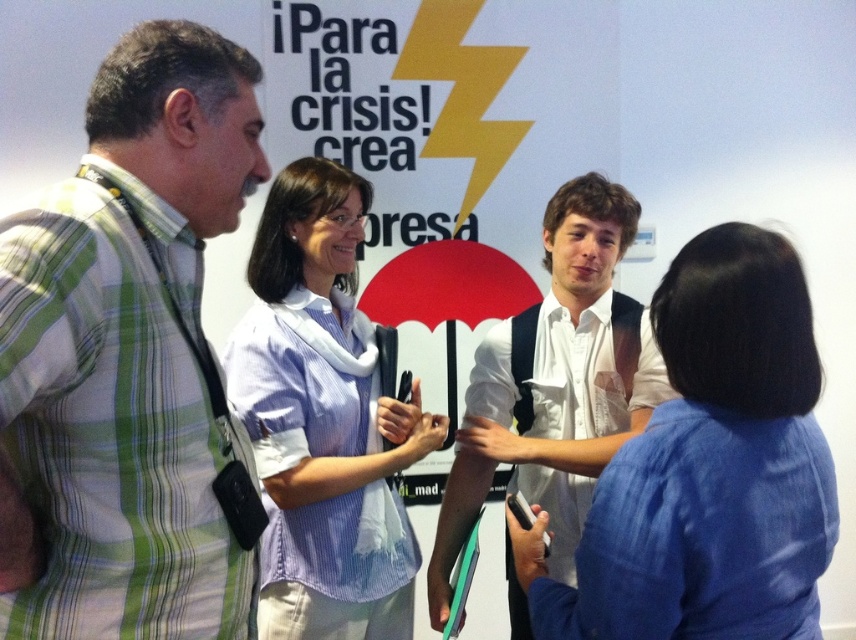
Can you confirm if blue cotton shirt at center is bigger than white shirt at center?

Actually, blue cotton shirt at center might be smaller than white shirt at center.

Which is in front, point (516, 570) or point (657, 365)?

Point (516, 570) is in front.

Between point (783, 337) and point (530, 449), which one is positioned behind?

The point (530, 449) is more distant.

Find the location of a particular element. The image size is (856, 640). blue cotton shirt at center is located at coordinates (709, 468).

Which is more to the right, green plaid shirt at left or light blue striped shirt at center?

light blue striped shirt at center

Can you confirm if green plaid shirt at left is shorter than light blue striped shirt at center?

Correct, green plaid shirt at left is not as tall as light blue striped shirt at center.

Identify the location of green plaid shirt at left. (128, 358).

Where is `green plaid shirt at left`? green plaid shirt at left is located at coordinates (128, 358).

This screenshot has width=856, height=640. What are the coordinates of `green plaid shirt at left` in the screenshot? It's located at (128, 358).

Is green plaid shirt at left shorter than white shirt at center?

Correct, green plaid shirt at left is not as tall as white shirt at center.

Between point (123, 260) and point (607, 339), which one is positioned behind?

The point (607, 339) is more distant.

Locate an element on the screen. This screenshot has height=640, width=856. green plaid shirt at left is located at coordinates (128, 358).